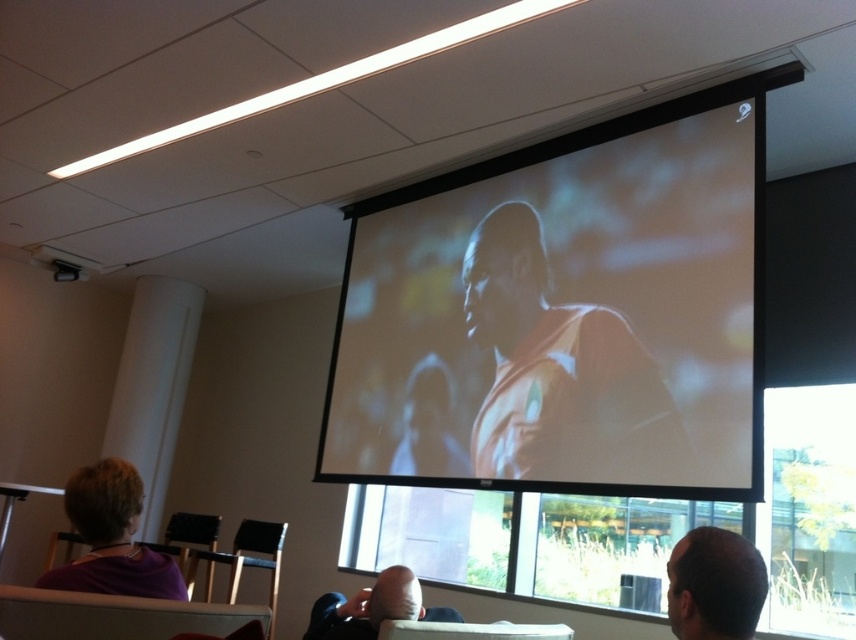
Question: Does orange fabric shirt at center appear on the left side of purple fabric at lower left?

Choices:
 (A) yes
 (B) no

Answer: (B)

Question: Can you confirm if purple fabric at lower left is positioned to the right of bald head at lower center?

Choices:
 (A) yes
 (B) no

Answer: (B)

Question: Which of the following is the closest to the observer?

Choices:
 (A) smooth bald head at lower right
 (B) bald head at lower center
 (C) purple fabric at lower left

Answer: (A)

Question: Can you confirm if smooth bald head at lower right is positioned to the left of metallic silver chair at lower left?

Choices:
 (A) no
 (B) yes

Answer: (A)

Question: Which of the following is the closest to the observer?

Choices:
 (A) (714, 637)
 (B) (195, 563)
 (C) (703, 209)

Answer: (A)

Question: Which point is closer to the camera taking this photo?

Choices:
 (A) (395, 579)
 (B) (260, 529)
 (C) (720, 592)
 (D) (431, 202)

Answer: (C)